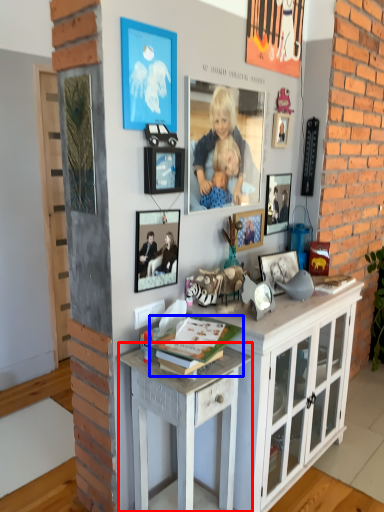
Question: Which of the following is the closest to the observer, desk (highlighted by a red box) or magazine (highlighted by a blue box)?

Choices:
 (A) desk
 (B) magazine

Answer: (B)